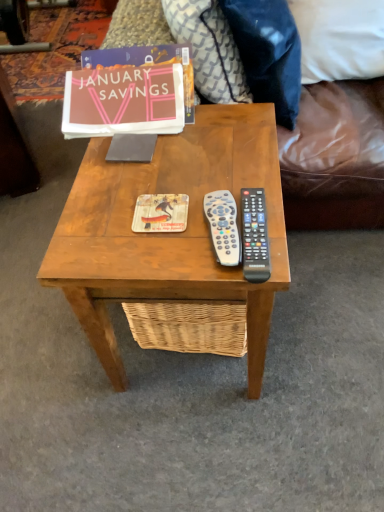
Question: From the image's perspective, is white plastic remote at center, positioned as the first remote control in left-to-right order, above or below matte paper book at upper center?

Choices:
 (A) above
 (B) below

Answer: (B)

Question: Considering the relative positions of white plastic remote at center, arranged as the 2th remote control when viewed from the right, and matte paper book at upper center in the image provided, is white plastic remote at center, arranged as the 2th remote control when viewed from the right, to the left or to the right of matte paper book at upper center?

Choices:
 (A) right
 (B) left

Answer: (A)

Question: Estimate the real-world distances between objects in this image. Which object is closer to the wooden coffee table at center?

Choices:
 (A) velvety dark blue pillow at upper right, marked as the 2th pillow in a right-to-left arrangement
 (B) matte paper book cover at center
 (C) matte paper book at upper center
 (D) brown fabric couch at upper center
 (E) white fabric pillow at upper right, which is the 1th pillow from right to left

Answer: (B)

Question: Estimate the real-world distances between objects in this image. Which object is closer to the velvety dark blue pillow at upper right, marked as the 2th pillow in a right-to-left arrangement?

Choices:
 (A) matte paper book at upper center
 (B) black plastic remote at center right, placed as the second remote control when sorted from left to right
 (C) white fabric pillow at upper right, which is the 1th pillow from right to left
 (D) white plastic remote at center, arranged as the 2th remote control when viewed from the right
 (E) brown fabric couch at upper center

Answer: (A)